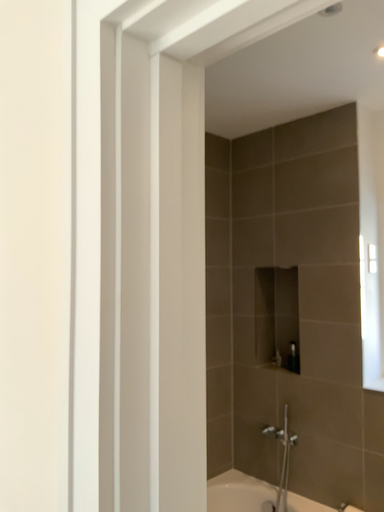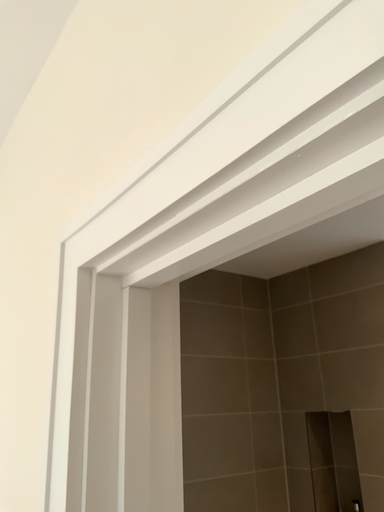
Question: How did the camera likely rotate when shooting the video?

Choices:
 (A) rotated right
 (B) rotated left

Answer: (B)